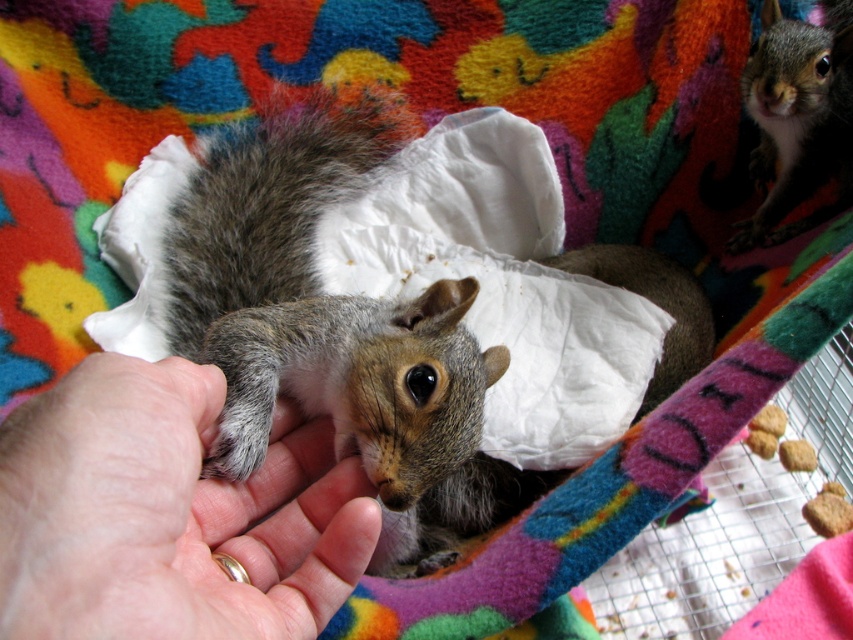
Question: Does gray fur squirrel at center have a smaller size compared to gray fur squirrel at upper right?

Choices:
 (A) no
 (B) yes

Answer: (A)

Question: Which is farther from the gray fur squirrel at upper right?

Choices:
 (A) smooth skin hand at center
 (B) gray fur squirrel at center

Answer: (A)

Question: Does gray fur squirrel at center appear on the right side of gray fur squirrel at upper right?

Choices:
 (A) no
 (B) yes

Answer: (A)

Question: Does gray fur squirrel at center appear on the left side of smooth skin hand at center?

Choices:
 (A) no
 (B) yes

Answer: (A)

Question: Which point is farther to the camera?

Choices:
 (A) gray fur squirrel at center
 (B) smooth skin hand at center

Answer: (A)

Question: Which point is farther from the camera taking this photo?

Choices:
 (A) (784, 52)
 (B) (310, 244)

Answer: (B)